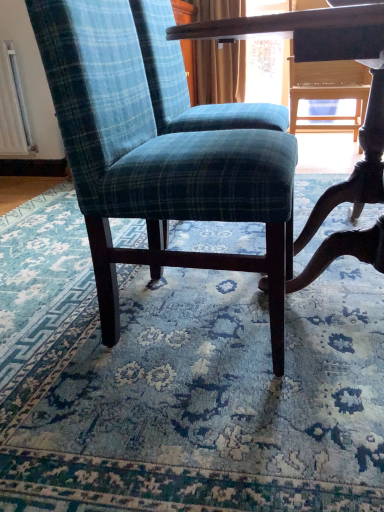
Describe the element at coordinates (181, 383) in the screenshot. I see `blue plaid fabric chair at center` at that location.

Locate an element on the screen. blue plaid fabric chair at center is located at coordinates (181, 383).

Measure the distance between point (149, 476) and camera.

Point (149, 476) and camera are 30.43 inches apart from each other.

Where is `teal plaid fabric chair at center`? This screenshot has height=512, width=384. teal plaid fabric chair at center is located at coordinates (156, 160).

Describe the element at coordinates (156, 160) in the screenshot. I see `teal plaid fabric chair at center` at that location.

Locate an element on the screen. blue plaid fabric chair at center is located at coordinates (181, 383).

Which is more to the right, blue plaid fabric chair at center or teal plaid fabric chair at center?

Positioned to the right is teal plaid fabric chair at center.

Considering their positions, is blue plaid fabric chair at center located in front of or behind teal plaid fabric chair at center?

Visually, blue plaid fabric chair at center is located in front of teal plaid fabric chair at center.

Considering the positions of point (151, 394) and point (94, 10), is point (151, 394) closer or farther from the camera than point (94, 10)?

Clearly, point (151, 394) is more distant from the camera than point (94, 10).

From the image's perspective, which object appears higher, blue plaid fabric chair at center or teal plaid fabric chair at center?

teal plaid fabric chair at center appears higher in the image.

From a real-world perspective, which object rests below the other?

From a 3D spatial view, blue plaid fabric chair at center is below.

Considering the sizes of objects blue plaid fabric chair at center and teal plaid fabric chair at center in the image provided, who is thinner, blue plaid fabric chair at center or teal plaid fabric chair at center?

Thinner between the two is teal plaid fabric chair at center.

From their relative heights in the image, would you say blue plaid fabric chair at center is taller or shorter than teal plaid fabric chair at center?

Considering their sizes, blue plaid fabric chair at center has less height than teal plaid fabric chair at center.

Is blue plaid fabric chair at center bigger or smaller than teal plaid fabric chair at center?

In the image, blue plaid fabric chair at center appears to be smaller than teal plaid fabric chair at center.

Can we say blue plaid fabric chair at center lies outside teal plaid fabric chair at center?

Indeed, blue plaid fabric chair at center is completely outside teal plaid fabric chair at center.

Would you consider blue plaid fabric chair at center to be distant from teal plaid fabric chair at center?

No, blue plaid fabric chair at center is in close proximity to teal plaid fabric chair at center.

Is blue plaid fabric chair at center positioned with its back to teal plaid fabric chair at center?

That's not correct — blue plaid fabric chair at center is not looking away from teal plaid fabric chair at center.

Can you tell me how much blue plaid fabric chair at center and teal plaid fabric chair at center differ in facing direction?

blue plaid fabric chair at center and teal plaid fabric chair at center are facing 177 degrees away from each other.

Locate an element on the screen. This screenshot has width=384, height=512. chair that is above the blue plaid fabric chair at center (from the image's perspective) is located at coordinates (156, 160).

Considering the relative positions of teal plaid fabric chair at center and blue plaid fabric chair at center in the image provided, is teal plaid fabric chair at center to the right of blue plaid fabric chair at center from the viewer's perspective?

Yes.

Who is more distant, teal plaid fabric chair at center or blue plaid fabric chair at center?

teal plaid fabric chair at center is further away from the camera.

Is point (275, 340) behind point (313, 193)?

No.

From the image's perspective, between teal plaid fabric chair at center and blue plaid fabric chair at center, who is located below?

From the image's view, blue plaid fabric chair at center is below.

From a real-world perspective, between teal plaid fabric chair at center and blue plaid fabric chair at center, who is vertically lower?

blue plaid fabric chair at center.

Does teal plaid fabric chair at center have a greater width compared to blue plaid fabric chair at center?

No.

Does teal plaid fabric chair at center have a greater height compared to blue plaid fabric chair at center?

Yes.

Can you confirm if teal plaid fabric chair at center is bigger than blue plaid fabric chair at center?

Indeed, teal plaid fabric chair at center has a larger size compared to blue plaid fabric chair at center.

Would you say teal plaid fabric chair at center contains blue plaid fabric chair at center?

No.

From the picture: Are teal plaid fabric chair at center and blue plaid fabric chair at center making contact?

teal plaid fabric chair at center and blue plaid fabric chair at center are clearly separated.

Is teal plaid fabric chair at center aimed at blue plaid fabric chair at center?

No, teal plaid fabric chair at center is not oriented towards blue plaid fabric chair at center.

The image size is (384, 512). What are the coordinates of `chair above the blue plaid fabric chair at center (from the image's perspective)` in the screenshot? It's located at (156, 160).

Identify the location of chair behind the blue plaid fabric chair at center. (156, 160).

The height and width of the screenshot is (512, 384). Identify the location of chair above the blue plaid fabric chair at center (from a real-world perspective). (156, 160).